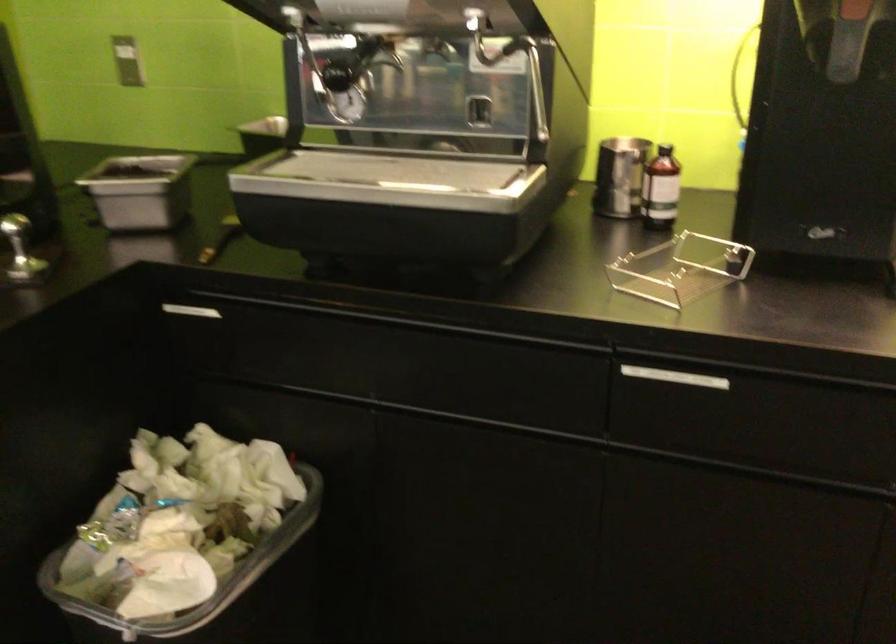
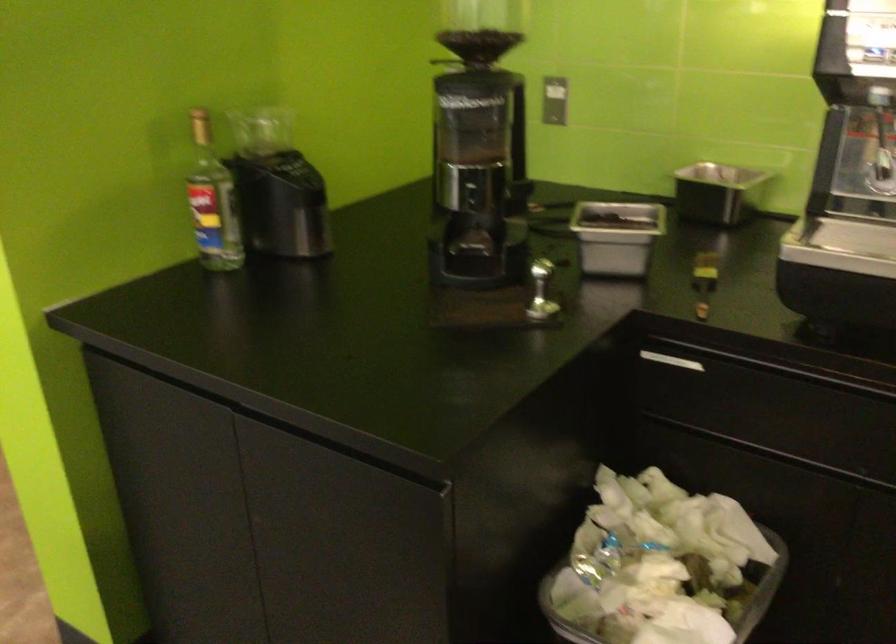
Question: Which direction would the cameraman need to move to produce the second image? Reply with the corresponding letter.

Choices:
 (A) Left
 (B) Right
 (C) Forward
 (D) Backward

Answer: (A)